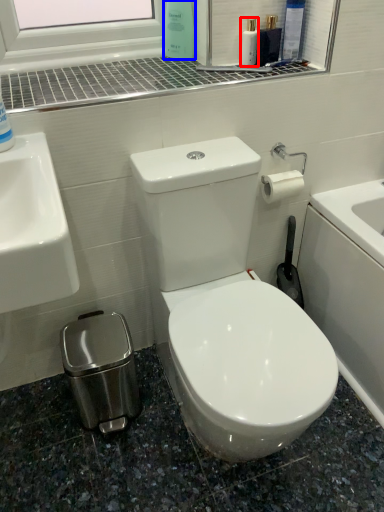
Question: Which point is further to the camera, mouthwash (highlighted by a red box) or cleaning product (highlighted by a blue box)?

Choices:
 (A) mouthwash
 (B) cleaning product

Answer: (B)